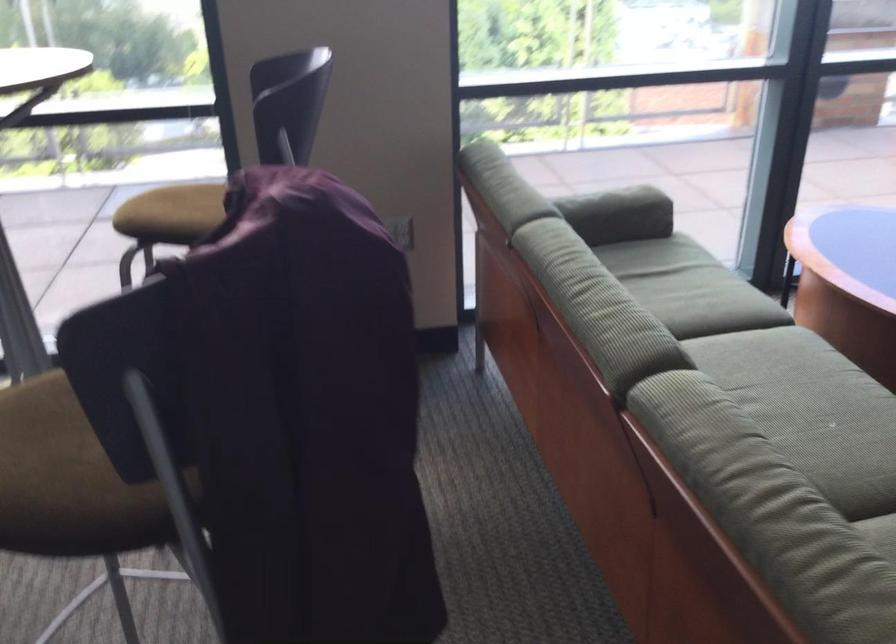
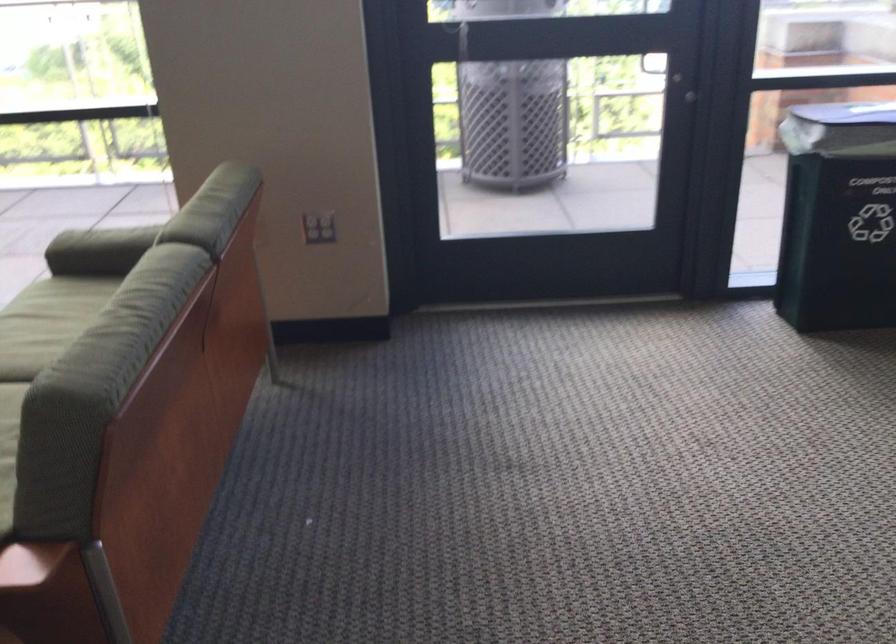
Question: What movement of the cameraman would produce the second image?

Choices:
 (A) Left
 (B) Right
 (C) Forward
 (D) Backward

Answer: (B)